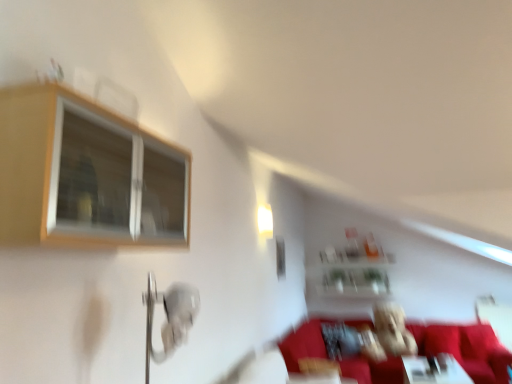
Question: Is white glossy table at lower right taller or shorter than fuzzy fabric teddy bear at center?

Choices:
 (A) short
 (B) tall

Answer: (A)

Question: Is white glossy table at lower right wider or thinner than fuzzy fabric teddy bear at center?

Choices:
 (A) thin
 (B) wide

Answer: (B)

Question: Estimate the real-world distances between objects in this image. Which object is closer to the fuzzy fabric teddy bear at center?

Choices:
 (A) velvet red couch at lower right
 (B) clear glass shelf at upper center
 (C) white glossy table at lower right
 (D) wooden frame window at upper left
 (E) white glossy light fixture at upper center

Answer: (C)

Question: Based on their relative distances, which object is farther from the white glossy light fixture at upper center?

Choices:
 (A) clear glass shelf at upper center
 (B) fuzzy fabric teddy bear at center
 (C) white glossy table at lower right
 (D) wooden frame window at upper left
 (E) velvet red couch at lower right

Answer: (E)